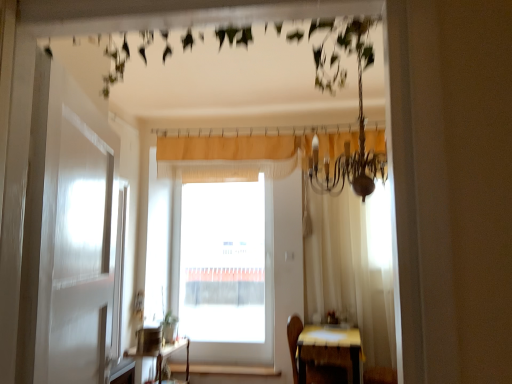
Identify the location of wooden at lower center. The image size is (512, 384). (234, 370).

What do you see at coordinates (234, 370) in the screenshot? The width and height of the screenshot is (512, 384). I see `wooden at lower center` at bounding box center [234, 370].

Find the location of a particular element. The width and height of the screenshot is (512, 384). transparent glass window at center is located at coordinates 223,262.

This screenshot has width=512, height=384. What are the coordinates of `wooden table at lower right, positioned as the 1th table in right-to-left order` in the screenshot? It's located at (330, 350).

Describe the element at coordinates (330, 350) in the screenshot. Image resolution: width=512 pixels, height=384 pixels. I see `wooden table at lower right, positioned as the 1th table in right-to-left order` at that location.

Locate an element on the screen. This screenshot has width=512, height=384. wooden at lower center is located at coordinates (234, 370).

In the scene shown: Could you tell me if wooden table at center, which appears as the 2th table when viewed from the right, is turned towards wooden table at lower right, positioned as the 1th table in right-to-left order?

Yes.

Considering the points (179, 383) and (355, 329), which point is in front, point (179, 383) or point (355, 329)?

The point (355, 329) is closer.

Which object is positioned more to the right, wooden table at center, which appears as the 2th table when viewed from the right, or wooden table at lower right, positioned as the 1th table in right-to-left order?

From the viewer's perspective, wooden table at lower right, positioned as the 1th table in right-to-left order, appears more on the right side.

Measure the distance between wooden at lower center and wooden table at lower right, which is the second table from left to right.

wooden at lower center and wooden table at lower right, which is the second table from left to right, are 1.06 meters apart from each other.

Locate an element on the screen. This screenshot has width=512, height=384. window sill below the wooden table at lower right, which is the second table from left to right (from the image's perspective) is located at coordinates (234, 370).

From a real-world perspective, which is physically below, wooden at lower center or wooden table at lower right, positioned as the 1th table in right-to-left order?

wooden at lower center, from a real-world perspective.

Is transparent glass window at center wider or thinner than beige textured curtain at center?

In the image, transparent glass window at center appears to be wider than beige textured curtain at center.

Is transparent glass window at center next to beige textured curtain at center and touching it?

No, transparent glass window at center is not next to beige textured curtain at center.

In order to click on window screen lying behind the wooden table at center, which appears as the 2th table when viewed from the right in this screenshot , I will do `click(223, 262)`.

Is transparent glass window at center surrounded by wooden table at center, placed as the first table when sorted from left to right?

No, transparent glass window at center is not surrounded by wooden table at center, placed as the first table when sorted from left to right.

From the image's perspective, would you say wooden table at center, which appears as the 2th table when viewed from the right, is positioned over transparent glass window at center?

Incorrect, from the image's perspective, wooden table at center, which appears as the 2th table when viewed from the right, is lower than transparent glass window at center.

Between wooden table at center, which appears as the 2th table when viewed from the right, and transparent glass window at center, which one has less height?

wooden table at center, which appears as the 2th table when viewed from the right.

Is transparent glass window at center facing away from wooden at lower center?

transparent glass window at center is not turned away from wooden at lower center.

Which point is more distant from viewer, (259, 237) or (181, 369)?

The point (259, 237) is farther.

Is transparent glass window at center outside of wooden at lower center?

Yes, transparent glass window at center is located beyond the bounds of wooden at lower center.

Are transparent glass window at center and wooden at lower center making contact?

No, transparent glass window at center is not next to wooden at lower center.

From a real-world perspective, does wooden table at center, which appears as the 2th table when viewed from the right, sit lower than wooden at lower center?

No, from a real-world perspective, wooden table at center, which appears as the 2th table when viewed from the right, is not below wooden at lower center.

Considering the sizes of objects wooden table at center, which appears as the 2th table when viewed from the right, and wooden at lower center in the image provided, who is smaller, wooden table at center, which appears as the 2th table when viewed from the right, or wooden at lower center?

With smaller size is wooden at lower center.

Which point is more forward, (x=143, y=356) or (x=178, y=370)?

Positioned in front is point (x=143, y=356).

Is wooden table at center, placed as the first table when sorted from left to right, positioned behind wooden at lower center?

No, wooden table at center, placed as the first table when sorted from left to right, is closer to the camera.

Is wooden at lower center to the right of wooden table at center, which appears as the 2th table when viewed from the right, from the viewer's perspective?

Indeed, wooden at lower center is positioned on the right side of wooden table at center, which appears as the 2th table when viewed from the right.

Does wooden at lower center have a greater height compared to wooden table at center, placed as the first table when sorted from left to right?

No.

From the image's perspective, is wooden at lower center under wooden table at center, placed as the first table when sorted from left to right?

Yes, from the image's perspective, wooden at lower center is beneath wooden table at center, placed as the first table when sorted from left to right.

How many degrees apart are the facing directions of wooden at lower center and wooden table at center, placed as the first table when sorted from left to right?

The angle between the facing direction of wooden at lower center and the facing direction of wooden table at center, placed as the first table when sorted from left to right, is 85.3 degrees.

Locate an element on the screen. The image size is (512, 384). table in front of the wooden table at center, which appears as the 2th table when viewed from the right is located at coordinates (330, 350).

In order to click on table on the right side of wooden at lower center in this screenshot , I will do `click(330, 350)`.

Which object lies nearer to the anchor point wooden table at center, placed as the first table when sorted from left to right, wooden table at lower right, positioned as the 1th table in right-to-left order, or transparent glass window at center?

transparent glass window at center is positioned closer to the anchor wooden table at center, placed as the first table when sorted from left to right.

From the image, which object appears to be farther from transparent glass window at center, wooden table at center, which appears as the 2th table when viewed from the right, or wooden table at lower right, positioned as the 1th table in right-to-left order?

wooden table at lower right, positioned as the 1th table in right-to-left order, lies further to transparent glass window at center than the other object.

When comparing their distances from wooden at lower center, does wooden table at center, placed as the first table when sorted from left to right, or wooden table at lower right, which is the second table from left to right, seem further?

The object further to wooden at lower center is wooden table at lower right, which is the second table from left to right.

When comparing their distances from wooden table at center, placed as the first table when sorted from left to right, does beige textured curtain at center or transparent glass window at center seem further?

The object further to wooden table at center, placed as the first table when sorted from left to right, is beige textured curtain at center.

When comparing their distances from wooden table at lower right, which is the second table from left to right, does beige textured curtain at center or transparent glass window at center seem further?

Based on the image, beige textured curtain at center appears to be further to wooden table at lower right, which is the second table from left to right.

From the image, which object appears to be nearer to wooden table at lower right, positioned as the 1th table in right-to-left order, wooden at lower center or transparent glass window at center?

wooden at lower center lies closer to wooden table at lower right, positioned as the 1th table in right-to-left order, than the other object.

Looking at this image, from the image, which object appears to be farther from wooden table at center, which appears as the 2th table when viewed from the right, transparent glass window at center or wooden at lower center?

transparent glass window at center lies further to wooden table at center, which appears as the 2th table when viewed from the right, than the other object.

Which object lies further to the anchor point beige textured curtain at center, wooden table at center, which appears as the 2th table when viewed from the right, or transparent glass window at center?

wooden table at center, which appears as the 2th table when viewed from the right.

This screenshot has width=512, height=384. I want to click on window sill between wooden table at center, placed as the first table when sorted from left to right, and wooden table at lower right, positioned as the 1th table in right-to-left order, so click(x=234, y=370).

This screenshot has width=512, height=384. Find the location of `window screen that lies between beige textured curtain at center and wooden table at center, placed as the first table when sorted from left to right, from top to bottom`. window screen that lies between beige textured curtain at center and wooden table at center, placed as the first table when sorted from left to right, from top to bottom is located at coordinates (223, 262).

Where is `window screen between beige textured curtain at center and wooden table at lower right, which is the second table from left to right, in the vertical direction`? The height and width of the screenshot is (384, 512). window screen between beige textured curtain at center and wooden table at lower right, which is the second table from left to right, in the vertical direction is located at coordinates (223, 262).

The image size is (512, 384). What are the coordinates of `table that lies between beige textured curtain at center and wooden table at center, placed as the first table when sorted from left to right, from top to bottom` in the screenshot? It's located at (330, 350).